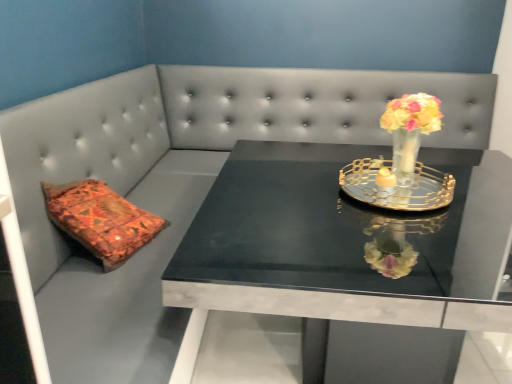
Question: Is translucent glass vase at upper right spatially inside gold metallic tray at center, or outside of it?

Choices:
 (A) outside
 (B) inside

Answer: (A)

Question: Based on their sizes in the image, would you say translucent glass vase at upper right is bigger or smaller than gold metallic tray at center?

Choices:
 (A) big
 (B) small

Answer: (A)

Question: Considering the real-world distances, which object is closest to the translucent glass vase at upper right?

Choices:
 (A) black marble table at center
 (B) gold metallic tray at center

Answer: (B)

Question: Estimate the real-world distances between objects in this image. Which object is farther from the black marble table at center?

Choices:
 (A) translucent glass vase at upper right
 (B) gold metallic tray at center

Answer: (A)